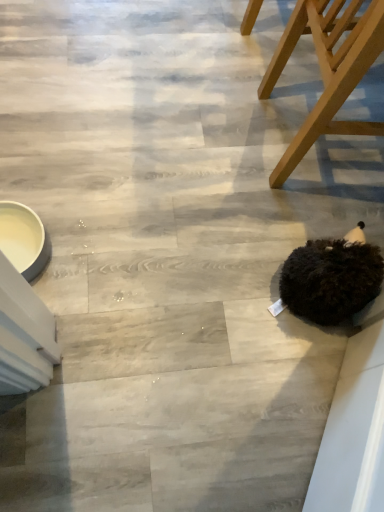
You are a GUI agent. You are given a task and a screenshot of the screen. Output one action in this format:
    pyautogui.click(x=<x>, y=<y>)
    Task: Click on the empty space that is ontop of black fuzzy ball at lower right (from a real-world perspective)
    The width and height of the screenshot is (384, 512).
    Given the screenshot: What is the action you would take?
    pyautogui.click(x=358, y=260)